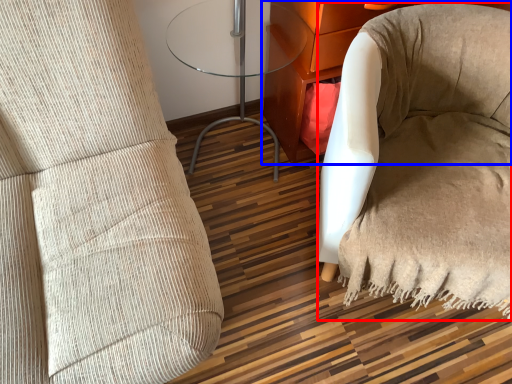
Question: Among these objects, which one is nearest to the camera, bean bag chair (highlighted by a red box) or furniture (highlighted by a blue box)?

Choices:
 (A) bean bag chair
 (B) furniture

Answer: (A)